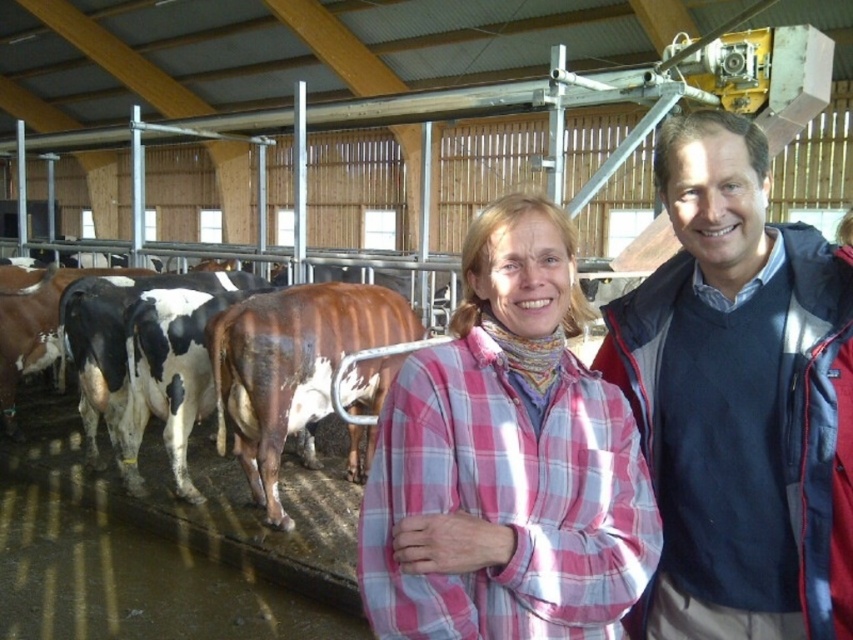
Question: Which point is farther to the camera?

Choices:
 (A) (720, 456)
 (B) (577, 324)

Answer: (B)

Question: Does dark blue sweater at center appear over pink plaid shirt at center?

Choices:
 (A) no
 (B) yes

Answer: (B)

Question: Can you confirm if dark blue sweater at center is bigger than pink plaid shirt at center?

Choices:
 (A) yes
 (B) no

Answer: (A)

Question: Which point appears farthest from the camera in this image?

Choices:
 (A) (656, 320)
 (B) (466, 252)

Answer: (A)

Question: Is dark blue sweater at center in front of pink plaid shirt at center?

Choices:
 (A) yes
 (B) no

Answer: (B)